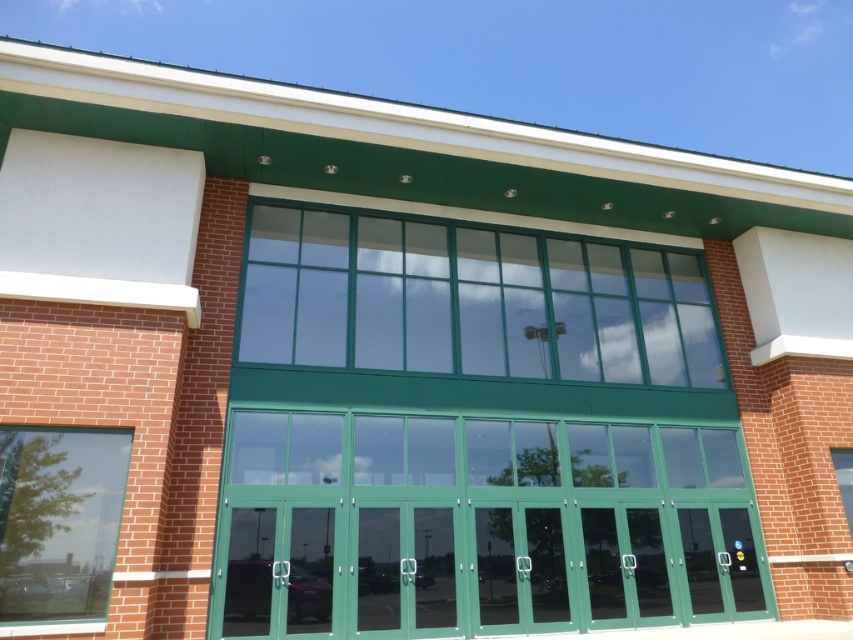
You are standing in front of the modern building and want to enter through one of the windows. The green glass window at center and the clear glass window at lower left are both visible. Which window is located higher up on the building?

The green glass window at center is positioned over the clear glass window at lower left, so it is located higher up on the building.

You are standing in front of the modern building described in the scene. There is a point at coordinates (471, 301) on the building facade. What object is located at that point?

The point at coordinates (471, 301) indicates the green glass window at center.

You are standing 25 feet away from the modern building. If you want to touch the green glass window at center, how many more feet do you need to walk forward?

The green glass window at center is 30.62 feet away from the viewer. Since you are currently 25 feet away, you need to walk an additional 5.62 feet forward to reach it.